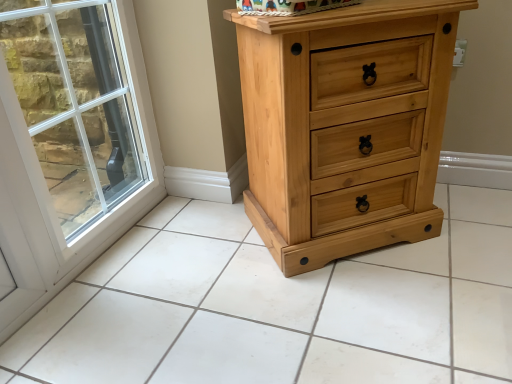
Locate an element on the screen. space that is in front of natural wood chest of drawers at right is located at coordinates (362, 311).